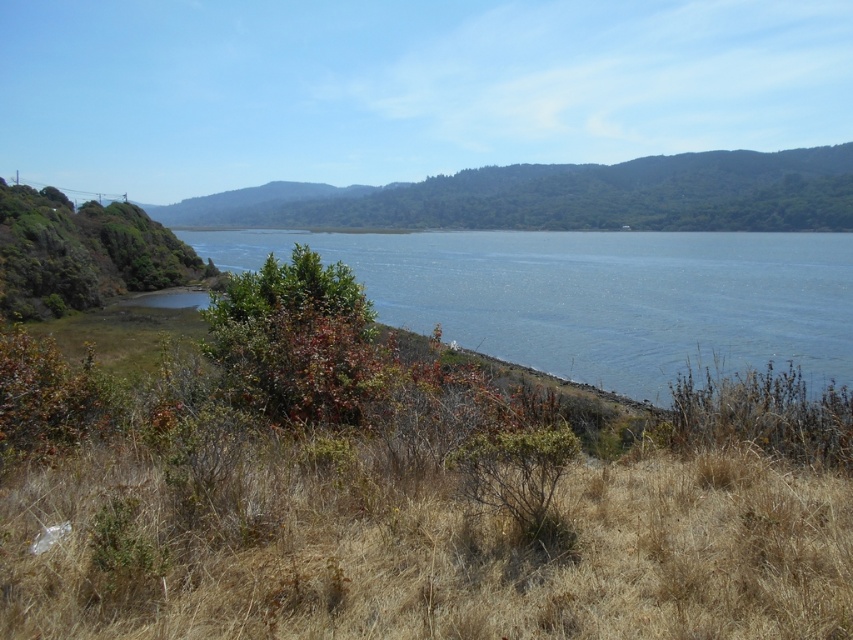
You are standing at the point marked by point (407,540) in the image. Looking around, you see dry grass at lower left. Which direction should you walk to reach the water edge?

The point (407,540) is located at the dry grass at lower left. To reach the water edge, you should walk towards the center of the image where the body of water is located.